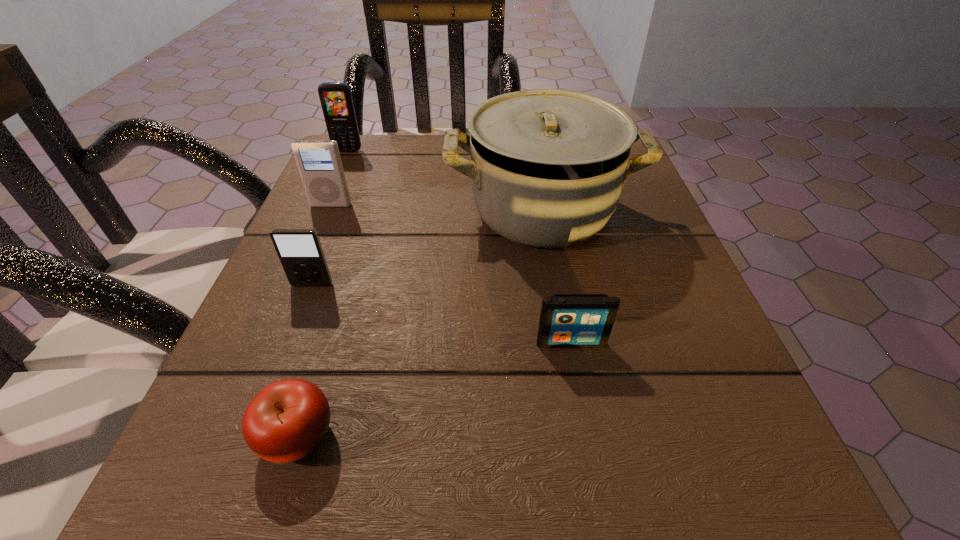
At what (x,y) coordinates should I click in order to perform the action: click on free space located 0.140m on the screen of the farthest object. Please return your answer as a coordinate pair (x, y). The width and height of the screenshot is (960, 540). Looking at the image, I should click on (331, 188).

Locate an element on the screen. Image resolution: width=960 pixels, height=540 pixels. free space located 0.250m on the front-facing side of the tallest iPod is located at coordinates 289,306.

Where is `vacant space located 0.250m on the front-facing side of the fourth tallest object`? The height and width of the screenshot is (540, 960). vacant space located 0.250m on the front-facing side of the fourth tallest object is located at coordinates (252, 442).

This screenshot has width=960, height=540. What are the coordinates of `free space located on the front screen of the shortest iPod` in the screenshot? It's located at (584, 409).

Where is `blank space located 0.090m on the right of the nearest object`? This screenshot has width=960, height=540. blank space located 0.090m on the right of the nearest object is located at coordinates (414, 436).

Image resolution: width=960 pixels, height=540 pixels. I want to click on saucepan present at the far edge, so click(x=547, y=166).

The width and height of the screenshot is (960, 540). Identify the location of cellular telephone located at the far edge. (336, 100).

Find the location of a particular element. Image resolution: width=960 pixels, height=540 pixels. object that is at the near edge is located at coordinates (288, 419).

This screenshot has height=540, width=960. Identify the location of cellular telephone at the left edge. coord(336,100).

Identify the location of apple positioned at the left edge. The height and width of the screenshot is (540, 960). (288, 419).